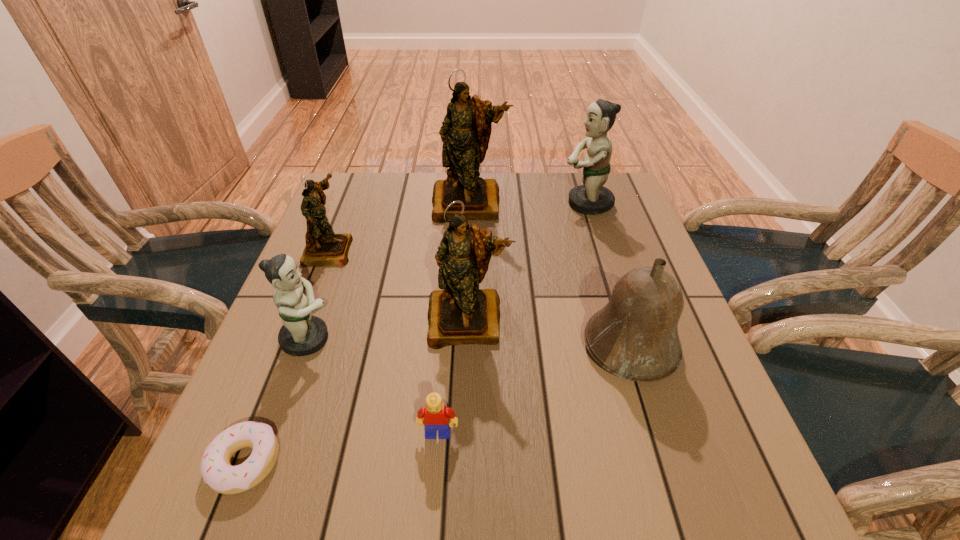
In the image, there is a desktop. Find the location of `vacant space at the near edge`. vacant space at the near edge is located at coordinates (411, 474).

Locate an element on the screen. This screenshot has width=960, height=540. free space at the left edge is located at coordinates (316, 392).

Image resolution: width=960 pixels, height=540 pixels. I want to click on vacant space at the right edge of the desktop, so click(x=591, y=238).

This screenshot has width=960, height=540. Identify the location of vacant area between the bigger green figurine and the nearest gold figurine. point(527,261).

Where is `free spot between the smaller green figurine and the doughnut`? free spot between the smaller green figurine and the doughnut is located at coordinates (277, 400).

Locate an element on the screen. vacant area between the rightmost figurine and the doughnut is located at coordinates (416, 333).

At what (x,y) coordinates should I click in order to perform the action: click on free point between the biggest gold figurine and the left green figurine. Please return your answer as a coordinate pair (x, y). The height and width of the screenshot is (540, 960). Looking at the image, I should click on (389, 271).

Where is `free area in between the shortest object and the second shortest object`? free area in between the shortest object and the second shortest object is located at coordinates (342, 448).

Locate an element on the screen. This screenshot has width=960, height=540. free space between the bell and the tallest object is located at coordinates (550, 275).

The height and width of the screenshot is (540, 960). In order to click on the third closest object to the farther green figurine in this screenshot , I will do `click(635, 336)`.